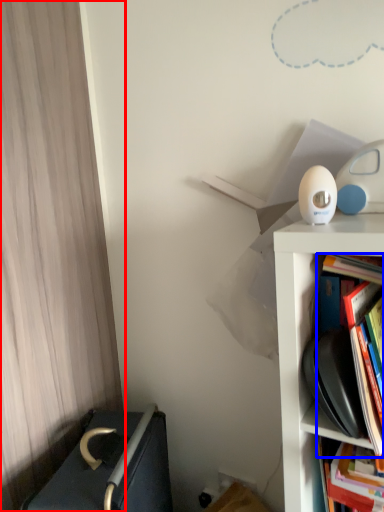
Question: Which point is further to the camera, curtain (highlighted by a red box) or book (highlighted by a blue box)?

Choices:
 (A) curtain
 (B) book

Answer: (A)